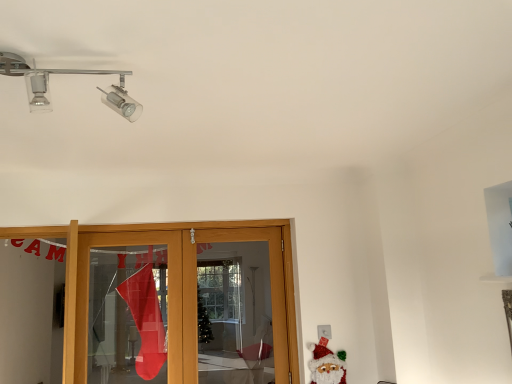
Question: Is felt santa claus at lower right taller or shorter than chrome/metallic track lighting at upper left?

Choices:
 (A) tall
 (B) short

Answer: (A)

Question: From a real-world perspective, relative to chrome/metallic track lighting at upper left, is felt santa claus at lower right vertically above or below?

Choices:
 (A) above
 (B) below

Answer: (B)

Question: Choose the correct answer: Is felt santa claus at lower right inside chrome/metallic track lighting at upper left or outside it?

Choices:
 (A) inside
 (B) outside

Answer: (B)

Question: In the image, is chrome/metallic track lighting at upper left on the left side or the right side of felt santa claus at lower right?

Choices:
 (A) left
 (B) right

Answer: (A)

Question: Does point (137, 105) appear closer or farther from the camera than point (343, 377)?

Choices:
 (A) farther
 (B) closer

Answer: (B)

Question: Is chrome/metallic track lighting at upper left inside or outside of felt santa claus at lower right?

Choices:
 (A) inside
 (B) outside

Answer: (B)

Question: From a real-world perspective, is chrome/metallic track lighting at upper left positioned above or below felt santa claus at lower right?

Choices:
 (A) below
 (B) above

Answer: (B)